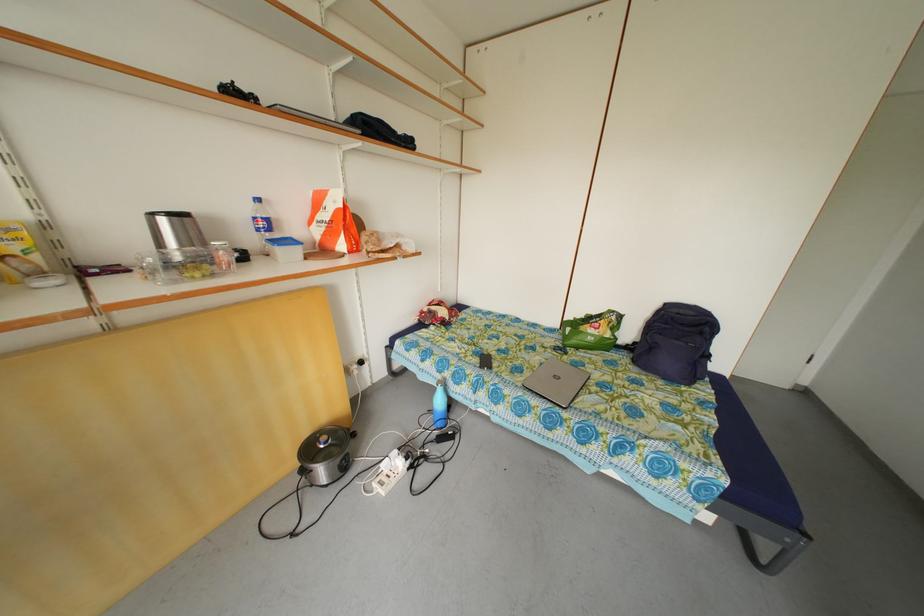
What do you see at coordinates (591, 331) in the screenshot? I see `a green chips bag` at bounding box center [591, 331].